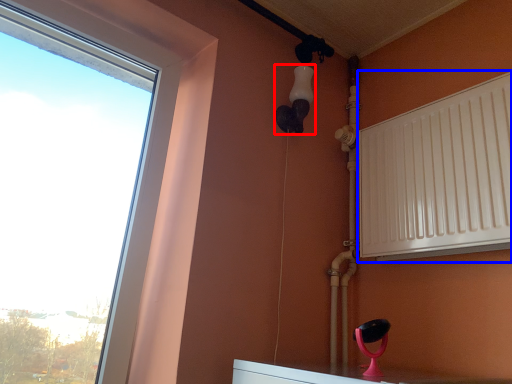
Question: Which of the following is the farthest to the observer, light fixture (highlighted by a red box) or radiator (highlighted by a blue box)?

Choices:
 (A) light fixture
 (B) radiator

Answer: (A)